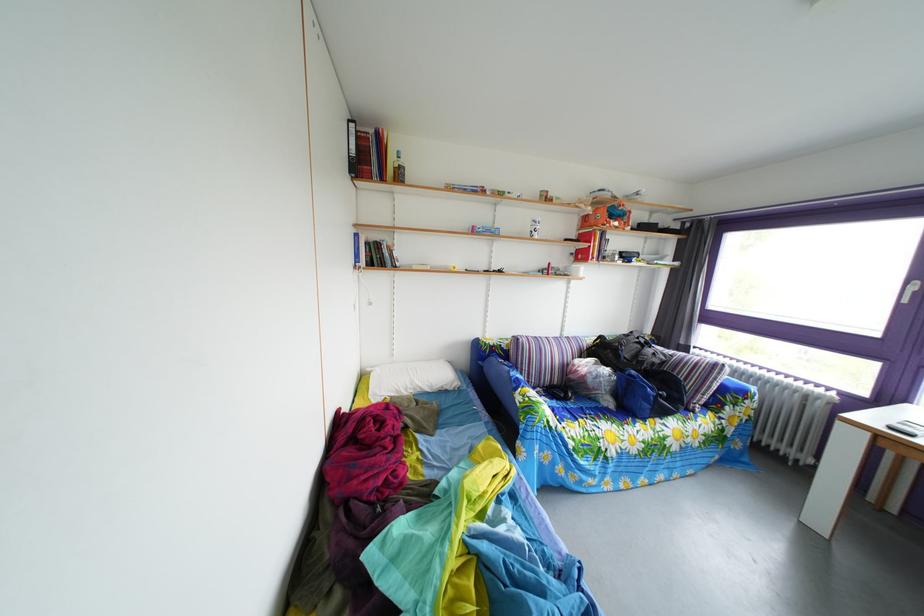
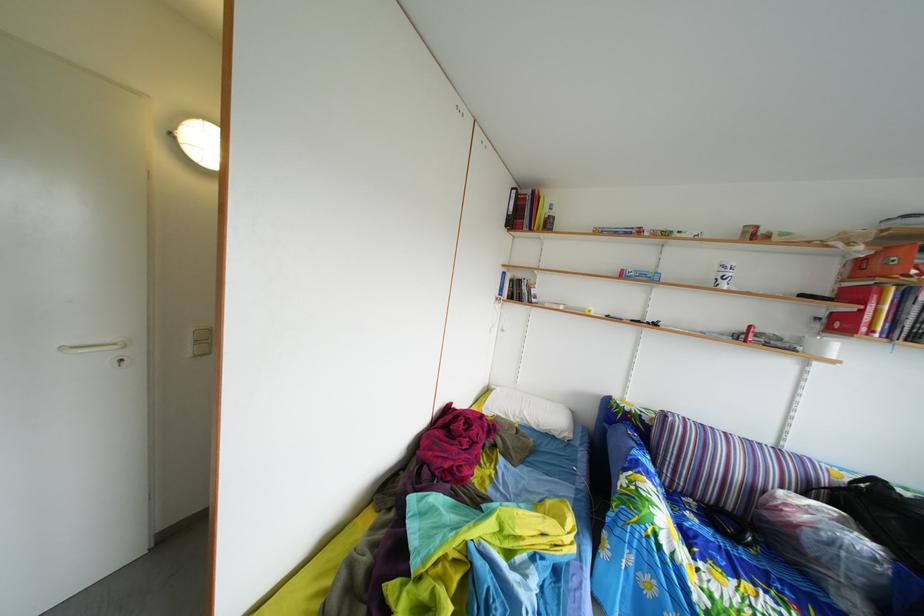
Locate, in the second image, the point that corresponds to point 541,232 in the first image.

(727, 276)